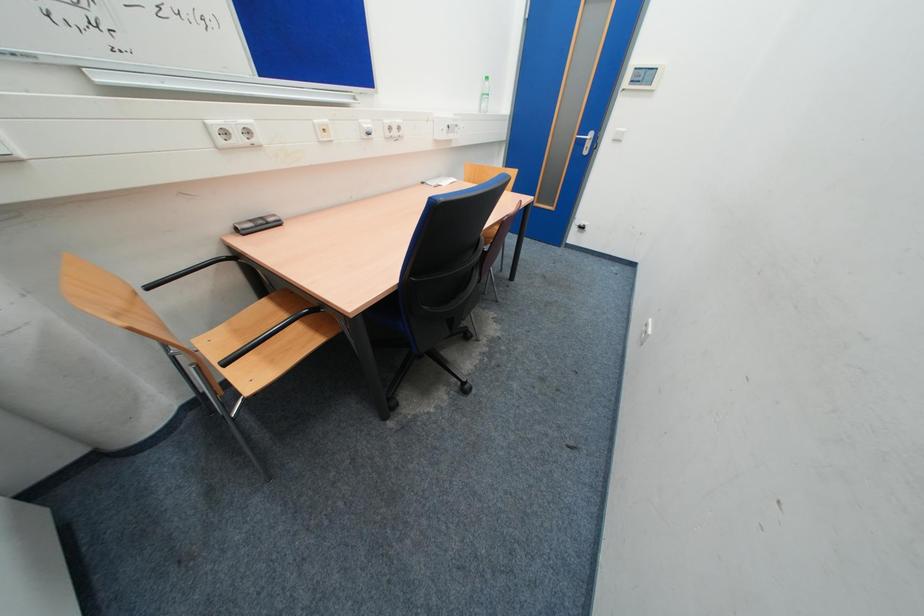
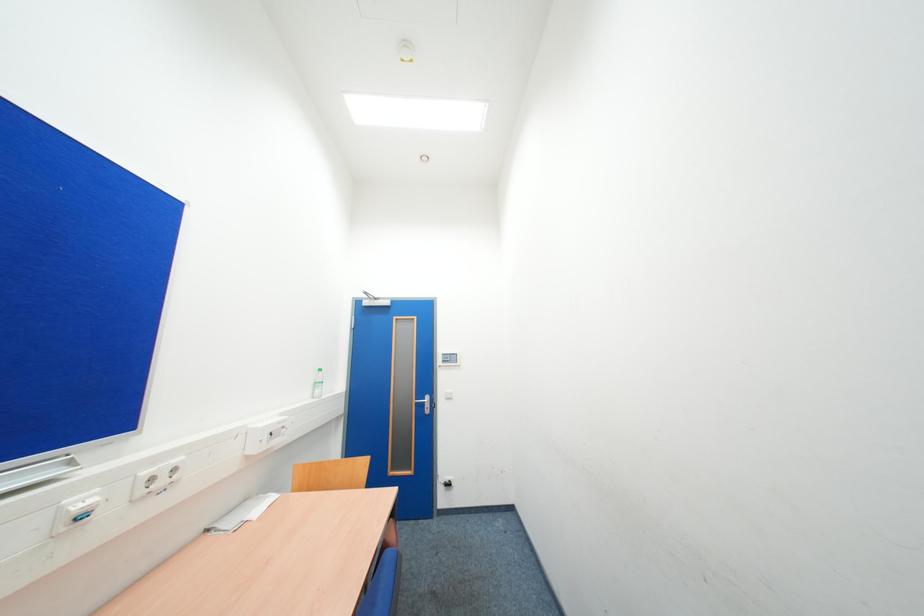
Based on the continuous images, in which direction is the camera rotating?

The rotation direction of the camera is right-up.